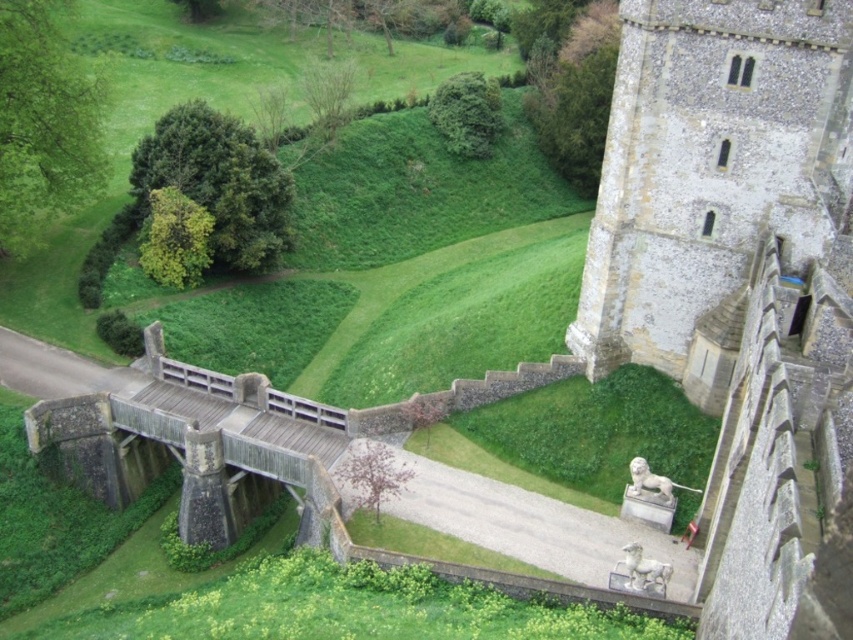
Does stone tower at right appear under wooden bridge at lower left?

Actually, stone tower at right is above wooden bridge at lower left.

The height and width of the screenshot is (640, 853). Identify the location of stone tower at right. (714, 179).

What are the coordinates of `stone tower at right` in the screenshot? It's located at (714, 179).